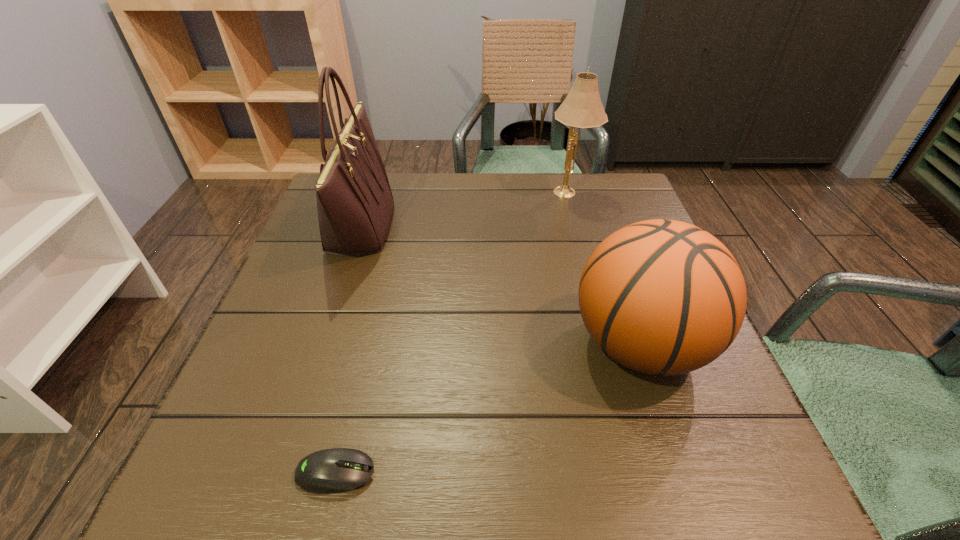
Find the location of a particular element. This screenshot has width=960, height=540. handbag is located at coordinates (355, 204).

Find the location of a particular element. The width and height of the screenshot is (960, 540). lampshade is located at coordinates (582, 108).

Identify the location of basketball. The width and height of the screenshot is (960, 540). (664, 297).

I want to click on the third tallest object, so click(664, 297).

What are the coordinates of `the nearest object` in the screenshot? It's located at (336, 470).

The image size is (960, 540). Identify the location of the shortest object. (336, 470).

Find the location of a particular element. This screenshot has height=540, width=960. vacant space located on the front-facing side of the handbag is located at coordinates [x=521, y=226].

In order to click on free space located on the right of the lampshade in this screenshot , I will do `click(630, 192)`.

Image resolution: width=960 pixels, height=540 pixels. What are the coordinates of `vacant space located on the back of the third tallest object` in the screenshot? It's located at (592, 200).

Where is `free spot located on the wheel side of the nearest object`? free spot located on the wheel side of the nearest object is located at coordinates (546, 473).